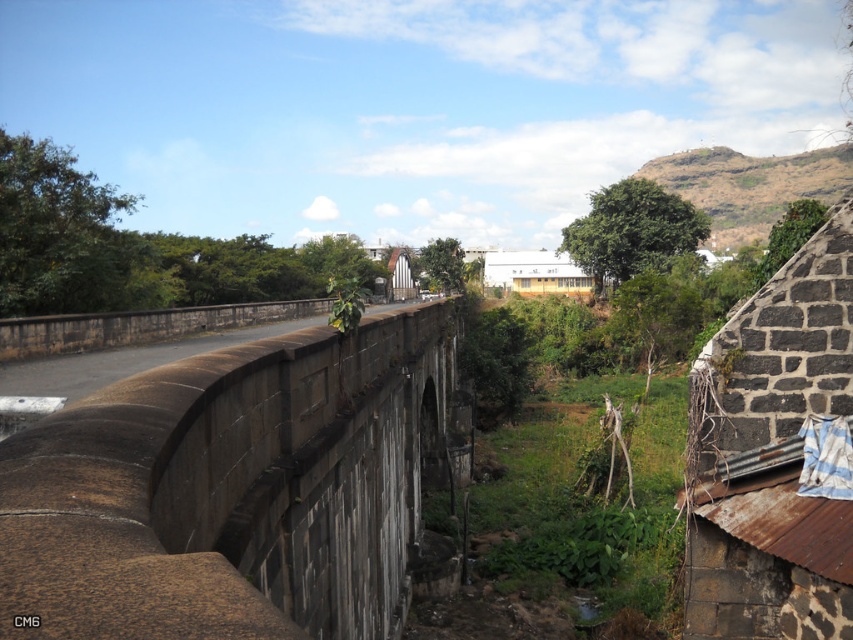
How much distance is there between brown stone bridge at center and dark gray stone wall at upper right?

brown stone bridge at center and dark gray stone wall at upper right are 17.71 feet apart.

Can you confirm if brown stone bridge at center is positioned below dark gray stone wall at upper right?

Correct, brown stone bridge at center is located below dark gray stone wall at upper right.

Identify the location of brown stone bridge at center. (231, 490).